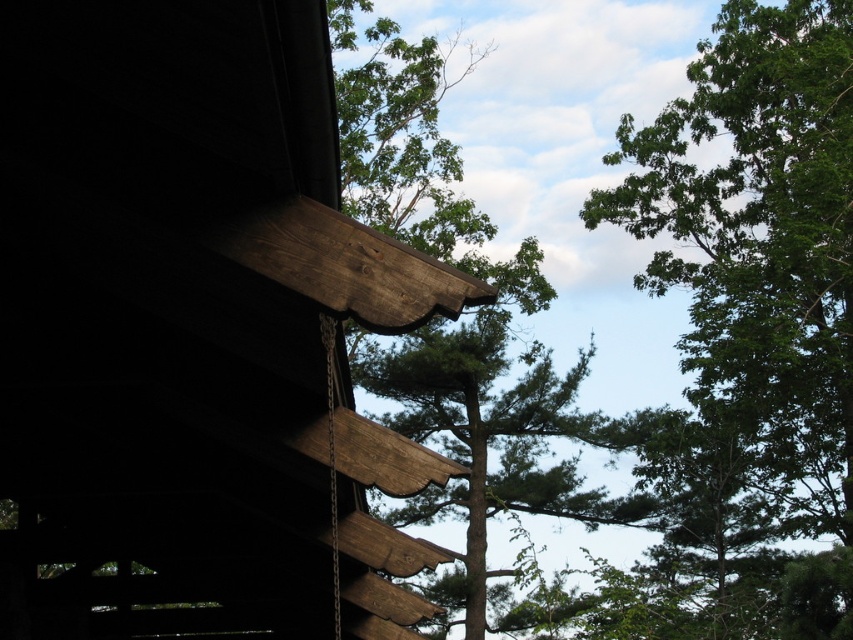
You are an architect analyzing the elevation of the dark brown wood cabin at upper left and the green leafy tree at upper right. Which one has a greater height?

The green leafy tree at upper right is taller than the dark brown wood cabin at upper left.